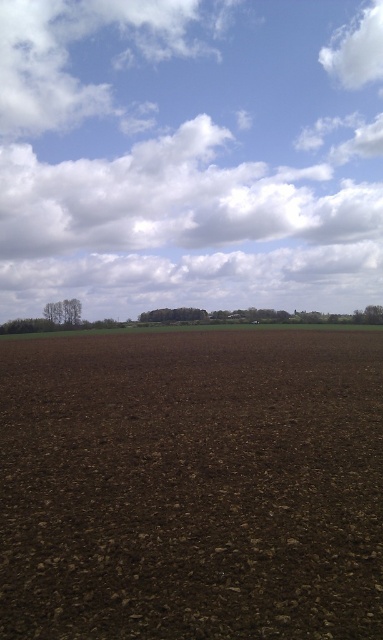
You are standing at the origin point in the image. Which direction should you move to reach the dark brown soil at center?

The dark brown soil at center is located at coordinates point (191, 484), so you should move towards the right and slightly forward to reach it.

You are a farmer looking at the sky to decide if rain is coming. You notice two clouds in the image. Which cloud, the white fluffy clouds at upper center or the white fluffy cloud at upper right, is higher in the sky?

The white fluffy clouds at upper center is taller than the white fluffy cloud at upper right, so it is higher in the sky.

You are standing at the point closest to the camera in the image. Looking at the two points labeled as point [284,550] and point [353,49], which point is closer to you?

Point [284,550] is in front of point [353,49], so it is closer to you.